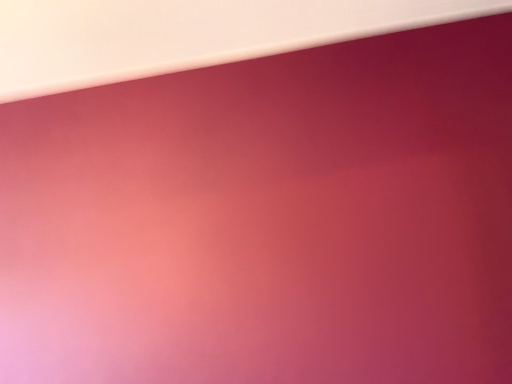
Measure the distance between point (x=221, y=56) and camera.

The depth of point (x=221, y=56) is 4.05 feet.

Find the location of a particular element. This screenshot has width=512, height=384. matte white ceiling at upper left is located at coordinates tap(185, 34).

This screenshot has height=384, width=512. Describe the element at coordinates (185, 34) in the screenshot. I see `matte white ceiling at upper left` at that location.

Identify the location of matte white ceiling at upper left. This screenshot has width=512, height=384. (185, 34).